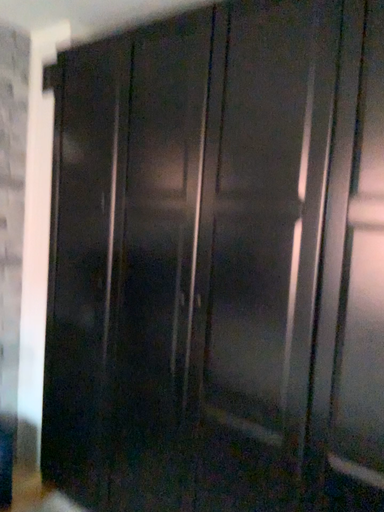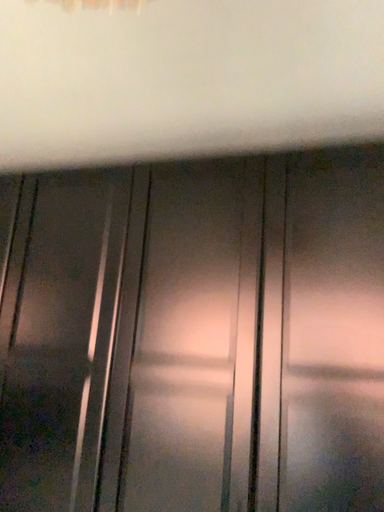
Question: How did the camera likely rotate when shooting the video?

Choices:
 (A) rotated left
 (B) rotated right

Answer: (B)